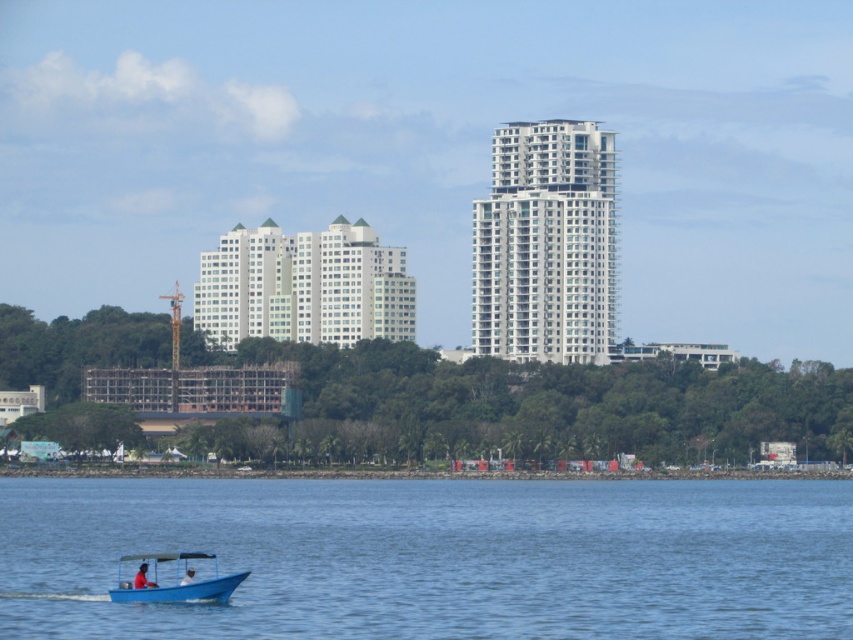
Is blue water at lower left closer to camera compared to blue plastic boat at lower left?

Yes, it is in front of blue plastic boat at lower left.

Where is `blue water at lower left`? blue water at lower left is located at coordinates (436, 557).